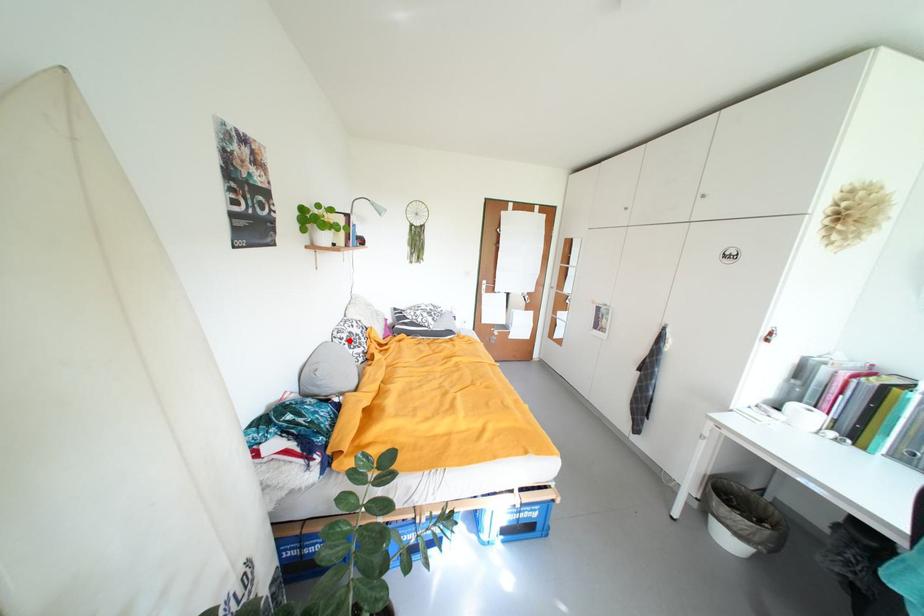
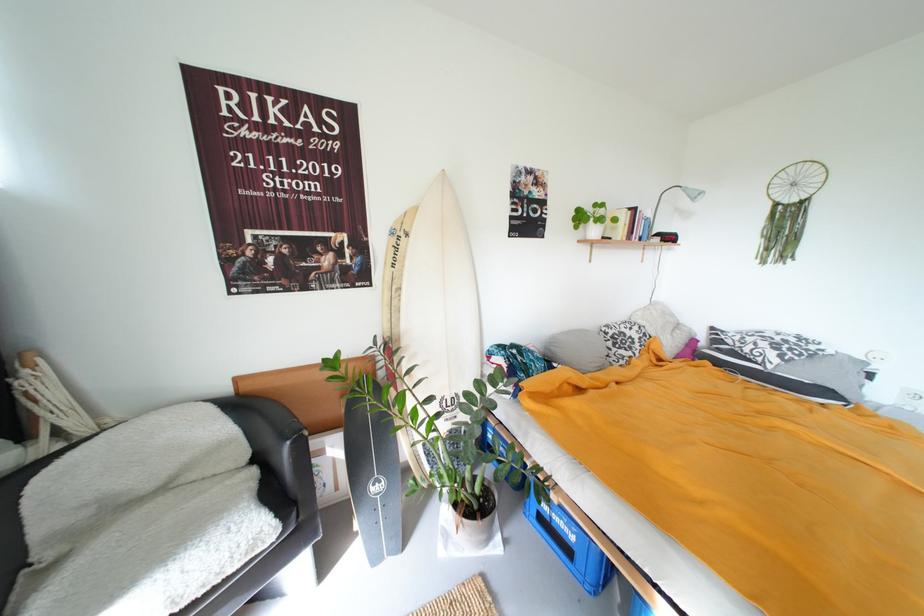
Question: I am providing you with two images of the same scene from different viewpoints. Image1 has a red point marked. In image2, the corresponding 3D location appears at what relative position? Reply with the corresponding letter.

Choices:
 (A) Closer
 (B) Farther

Answer: (B)